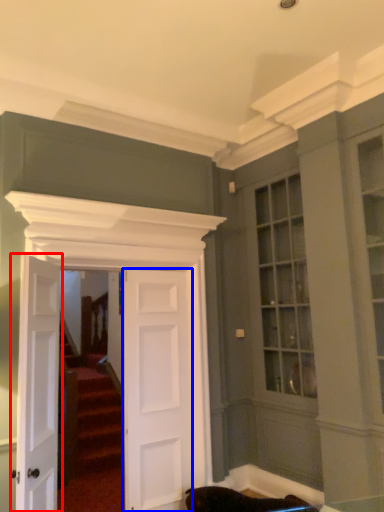
Question: Which of the following is the closest to the observer, door (highlighted by a red box) or door (highlighted by a blue box)?

Choices:
 (A) door
 (B) door

Answer: (A)